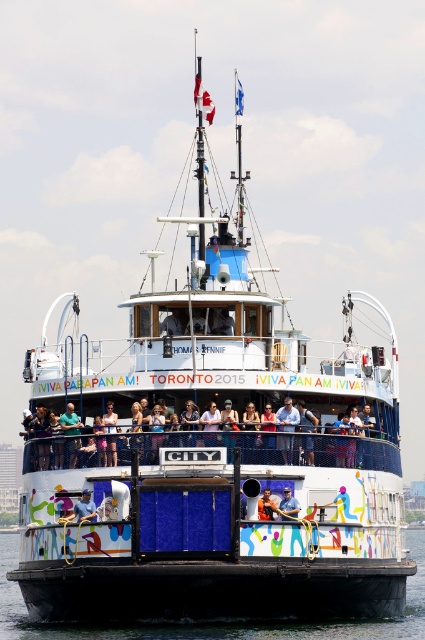
Where is `black rubber water at lower center`? This screenshot has height=640, width=425. black rubber water at lower center is located at coordinates tap(215, 621).

Consider the image. Does black rubber water at lower center appear on the left side of blue denim jeans at center?

Indeed, black rubber water at lower center is positioned on the left side of blue denim jeans at center.

At what (x,y) coordinates should I click in order to perform the action: click on black rubber water at lower center. Please return your answer as a coordinate pair (x, y). The height and width of the screenshot is (640, 425). Looking at the image, I should click on (215, 621).

What are the coordinates of `black rubber water at lower center` in the screenshot? It's located at (215, 621).

The width and height of the screenshot is (425, 640). I want to click on black rubber water at lower center, so click(x=215, y=621).

Who is more distant from viewer, (265, 630) or (261, 512)?

The point (261, 512) is behind.

Between point (59, 634) and point (257, 516), which one is positioned behind?

Positioned behind is point (59, 634).

At what (x,y) coordinates should I click in order to perform the action: click on black rubber water at lower center. Please return your answer as a coordinate pair (x, y). The height and width of the screenshot is (640, 425). Looking at the image, I should click on pyautogui.click(x=215, y=621).

Is light blue fabric at center taller than blue denim jeans at center?

Yes, light blue fabric at center is taller than blue denim jeans at center.

Does light blue fabric at center have a smaller size compared to blue denim jeans at center?

No.

Between point (142, 456) and point (286, 499), which one is positioned behind?

Point (142, 456)

Find the location of `light blue fabric at center`. light blue fabric at center is located at coordinates (201, 442).